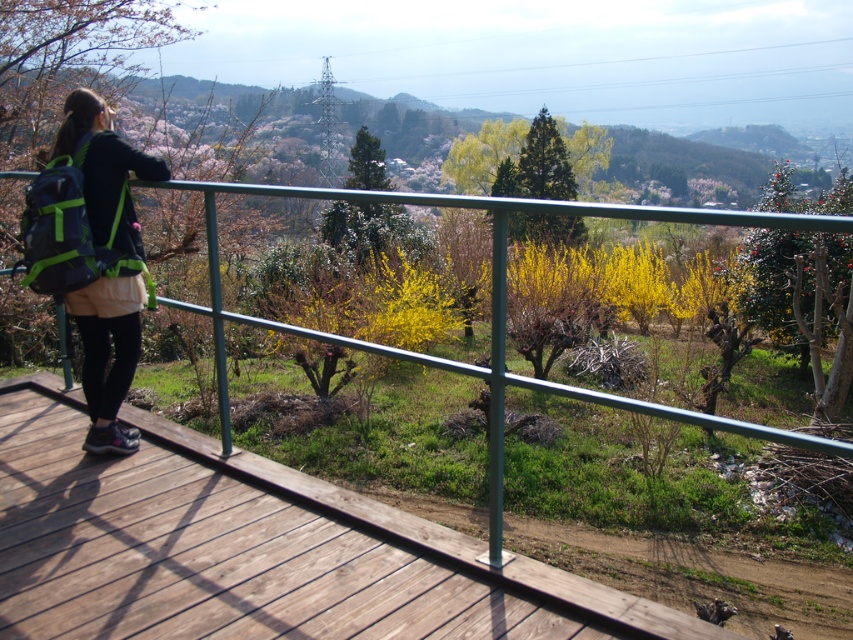
You are a hiker standing on the brown wooden deck at lower left and want to place your matte black backpack at left on the deck. Can you reach the deck from where the backpack is currently located?

The brown wooden deck at lower left is closer to the viewer than the matte black backpack at left, so the backpack is further away from the deck. Therefore, you cannot reach the deck from the backpacks current position.

In the scene shown: You are a hiker who wants to place your matte black backpack at left on the brown wooden deck at lower left. Can the backpack fit on the deck based on their widths?

The brown wooden deck at lower left is wider than the matte black backpack at left, so the backpack can fit on the deck.

You are a hiker who has just arrived at the wooden platform. You need to place your matte black backpack at left on the ground. Where should you place it so that it won not fall off the brown wooden deck at lower left?

The brown wooden deck at lower left is located below matte black backpack at left. To prevent the matte black backpack at left from falling off, you should place it on the brown wooden deck at lower left, ensuring it stays on the deck surface and not over the edge.